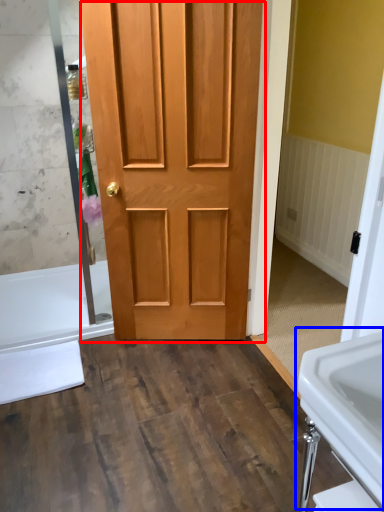
Question: Which of the following is the closest to the observer, door (highlighted by a red box) or sink (highlighted by a blue box)?

Choices:
 (A) door
 (B) sink

Answer: (B)